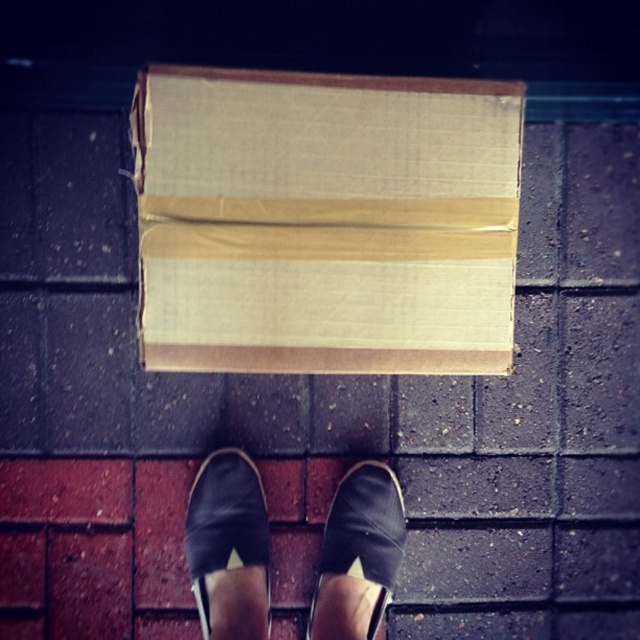
Question: Is brown cardboard box at center closer to the viewer compared to black canvas shoe at center?

Choices:
 (A) no
 (B) yes

Answer: (B)

Question: Which object is positioned farthest from the black canvas shoe at center?

Choices:
 (A) brown cardboard box at center
 (B) black leather shoe at center

Answer: (A)

Question: In this image, where is brown cardboard box at center located relative to black leather shoe at center?

Choices:
 (A) right
 (B) left

Answer: (B)

Question: Estimate the real-world distances between objects in this image. Which object is farther from the black leather shoe at center?

Choices:
 (A) brown cardboard box at center
 (B) black canvas shoe at center

Answer: (A)

Question: Is brown cardboard box at center positioned behind black leather shoe at center?

Choices:
 (A) no
 (B) yes

Answer: (A)

Question: Which object is the farthest from the black leather shoe at center?

Choices:
 (A) brown cardboard box at center
 (B) black canvas shoe at center

Answer: (A)